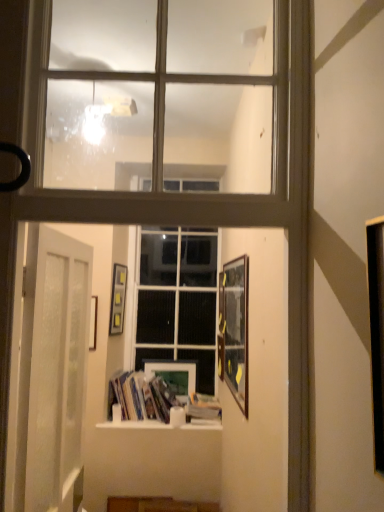
Question: Does wooden framed picture at right, the 3th picture frame in the left-to-right sequence, have a greater width compared to matte wooden picture frame at center, the first picture frame viewed from the back?

Choices:
 (A) yes
 (B) no

Answer: (A)

Question: Can you confirm if wooden framed picture at right, arranged as the third picture frame when viewed from the back, is smaller than matte wooden picture frame at center, the second picture frame in the right-to-left sequence?

Choices:
 (A) yes
 (B) no

Answer: (B)

Question: Does wooden framed picture at right, arranged as the third picture frame when viewed from the back, lie behind matte wooden picture frame at center, the second picture frame in the right-to-left sequence?

Choices:
 (A) yes
 (B) no

Answer: (B)

Question: Does wooden framed picture at right, the 3th picture frame in the left-to-right sequence, lie in front of matte wooden picture frame at center, the second picture frame in the right-to-left sequence?

Choices:
 (A) no
 (B) yes

Answer: (B)

Question: Can you confirm if wooden framed picture at right, arranged as the third picture frame when viewed from the back, is taller than matte wooden picture frame at center, which is counted as the 3th picture frame, starting from the front?

Choices:
 (A) no
 (B) yes

Answer: (B)

Question: Is hardcover books at center wider or thinner than matte wooden picture frame at center, the first picture frame viewed from the back?

Choices:
 (A) wide
 (B) thin

Answer: (A)

Question: Based on their positions, is hardcover books at center located to the left or right of matte wooden picture frame at center, the second picture frame in the right-to-left sequence?

Choices:
 (A) left
 (B) right

Answer: (A)

Question: From the image's perspective, is hardcover books at center positioned above or below matte wooden picture frame at center, the second picture frame in the right-to-left sequence?

Choices:
 (A) below
 (B) above

Answer: (A)

Question: In terms of height, does hardcover books at center look taller or shorter compared to matte wooden picture frame at center, the second picture frame in the right-to-left sequence?

Choices:
 (A) short
 (B) tall

Answer: (A)

Question: In the image, is matte black picture frame at center, which ranks as the 3th picture frame in right-to-left order, positioned in front of or behind wooden framed picture at right, the 3th picture frame in the left-to-right sequence?

Choices:
 (A) front
 (B) behind

Answer: (B)

Question: From a real-world perspective, is matte black picture frame at center, which ranks as the 2th picture frame in front-to-back order, positioned above or below wooden framed picture at right, arranged as the third picture frame when viewed from the back?

Choices:
 (A) above
 (B) below

Answer: (A)

Question: Is matte black picture frame at center, which ranks as the 2th picture frame in front-to-back order, spatially inside wooden framed picture at right, arranged as the third picture frame when viewed from the back, or outside of it?

Choices:
 (A) inside
 (B) outside

Answer: (B)

Question: Is matte black picture frame at center, which ranks as the second picture frame in back-to-front order, taller or shorter than wooden framed picture at right, which appears as the first picture frame when viewed from the right?

Choices:
 (A) short
 (B) tall

Answer: (A)

Question: Considering the positions of hardcover book at center and wooden framed picture at right, the 3th picture frame in the left-to-right sequence, in the image, is hardcover book at center taller or shorter than wooden framed picture at right, the 3th picture frame in the left-to-right sequence,?

Choices:
 (A) tall
 (B) short

Answer: (B)

Question: Considering the positions of point (196, 415) and point (238, 291), is point (196, 415) closer or farther from the camera than point (238, 291)?

Choices:
 (A) closer
 (B) farther

Answer: (B)